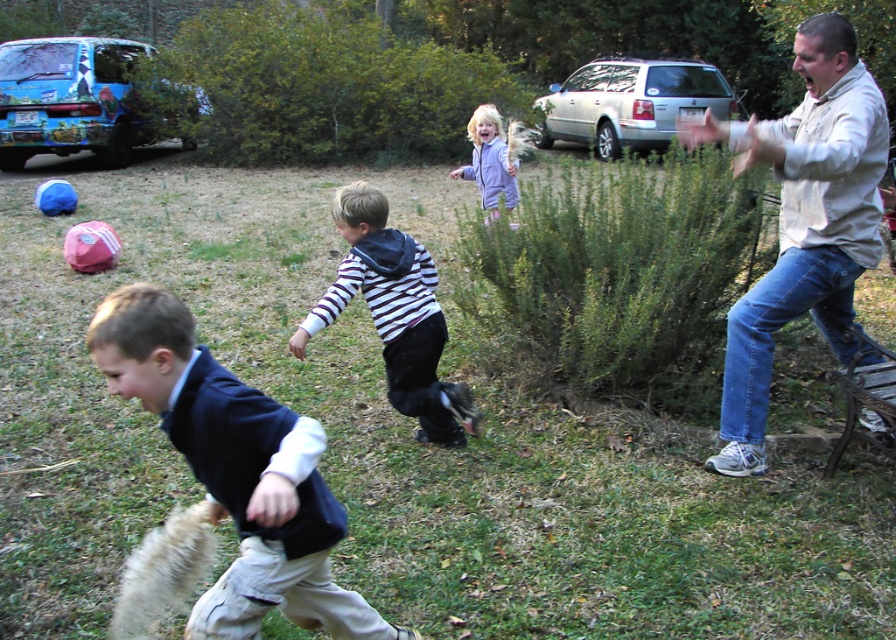
Question: Among these points, which one is nearest to the camera?

Choices:
 (A) click(454, 404)
 (B) click(498, 173)
 (C) click(229, 604)
 (D) click(864, 168)

Answer: (C)

Question: Which of the following is the closest to the observer?

Choices:
 (A) purple fleece jacket at upper center
 (B) dark blue sweater at lower left
 (C) beige cotton shirt at right
 (D) striped hoodie at center

Answer: (B)

Question: Is beige cotton shirt at right thinner than striped hoodie at center?

Choices:
 (A) yes
 (B) no

Answer: (B)

Question: Is beige cotton shirt at right to the right of striped hoodie at center from the viewer's perspective?

Choices:
 (A) yes
 (B) no

Answer: (A)

Question: Estimate the real-world distances between objects in this image. Which object is farther from the beige cotton shirt at right?

Choices:
 (A) purple fleece jacket at upper center
 (B) striped hoodie at center

Answer: (A)

Question: Does striped hoodie at center appear under purple fleece jacket at upper center?

Choices:
 (A) no
 (B) yes

Answer: (B)